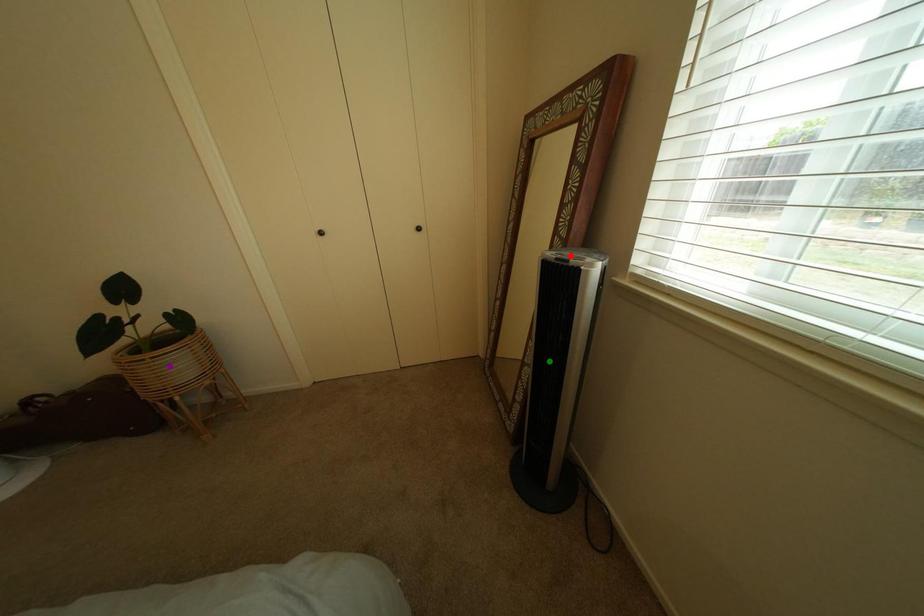
Order these from nearest to farthest:
red point, purple point, green point

red point < green point < purple point